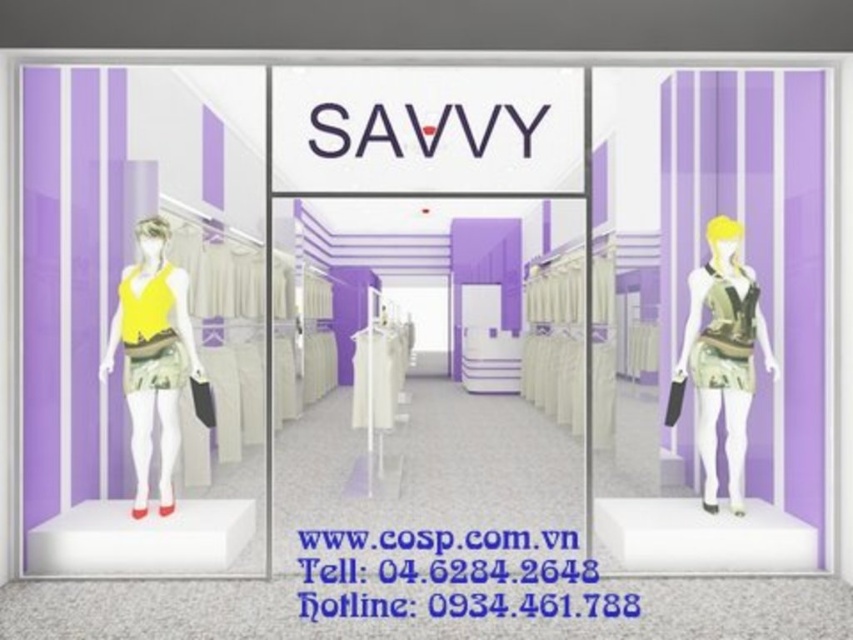
You are standing in front of the store and want to take a photo of the two points in the image. Which point, point [136,300] or point [166,296], will appear closer to you in the photo?

Point [136,300] is closer to the camera than point [166,296], so it will appear closer in the photo.

You are standing in front of the store and see the point at coordinates [152,356]. What object is located at that point?

The point at coordinates [152,356] corresponds to the matte yellow fabric dress at left.

You are a customer looking to buy a dress that is wider than the other. Which dress should you choose between the matte yellow fabric dress at left and the printed fabric dress at right?

The matte yellow fabric dress at left is wider than the printed fabric dress at right, so you should choose the matte yellow fabric dress at left.